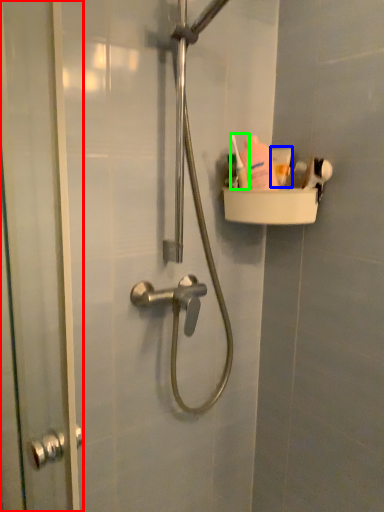
Question: Which object is positioned closest to screen door (highlighted by a red box)? Select from toothpaste (highlighted by a blue box) and toiletry (highlighted by a green box).

Choices:
 (A) toothpaste
 (B) toiletry

Answer: (B)